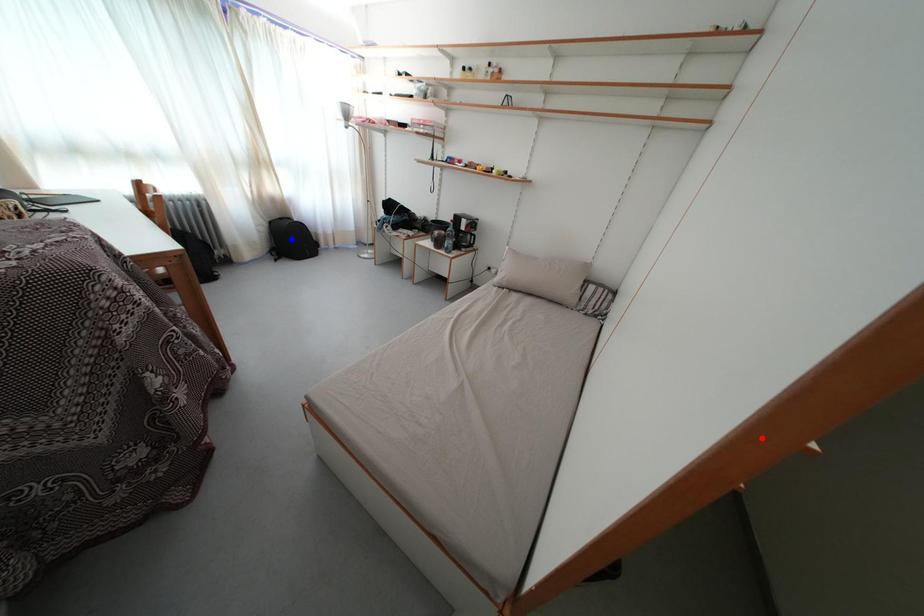
Question: Two points are marked on the image. Which point is closer to the camera?

Choices:
 (A) Blue point is closer.
 (B) Red point is closer.

Answer: (B)